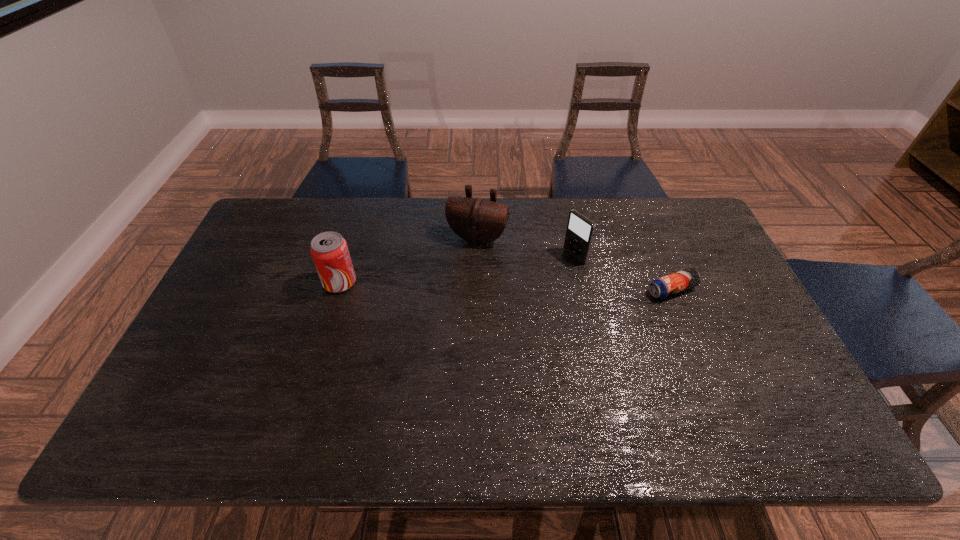
The height and width of the screenshot is (540, 960). What are the coordinates of `vacant area between the third object from right to left and the beer can` in the screenshot? It's located at (574, 264).

Find the location of `free area in between the shortest object and the third object from right to left`. free area in between the shortest object and the third object from right to left is located at coordinates (574, 264).

This screenshot has height=540, width=960. Find the location of `empty space that is in between the beer can and the third object from left to right`. empty space that is in between the beer can and the third object from left to right is located at coordinates (623, 273).

The width and height of the screenshot is (960, 540). I want to click on free point between the third object from left to right and the soda can, so point(457,269).

Locate an element on the screen. The width and height of the screenshot is (960, 540). blank region between the iPod and the leftmost object is located at coordinates (457, 269).

In order to click on empty space between the second object from right to left and the shortest object in this screenshot , I will do `click(623, 273)`.

The height and width of the screenshot is (540, 960). What are the coordinates of `unoccupied area between the soda can and the iPod` in the screenshot? It's located at pos(457,269).

Where is `unoccupied area between the iPod and the beer can`? unoccupied area between the iPod and the beer can is located at coordinates (623, 273).

Locate which object is the third closest to the soda can. Please provide its 2D coordinates. Your answer should be formatted as a tuple, i.e. [(x, y)], where the tuple contains the x and y coordinates of a point satisfying the conditions above.

[(668, 285)]

Select which object is the third closest to the shortest object. Please provide its 2D coordinates. Your answer should be formatted as a tuple, i.e. [(x, y)], where the tuple contains the x and y coordinates of a point satisfying the conditions above.

[(329, 250)]